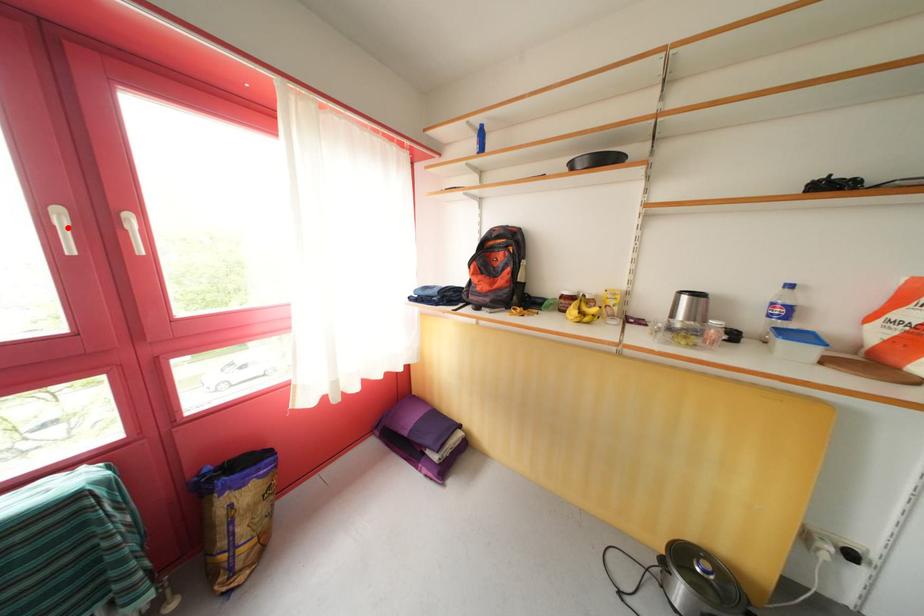
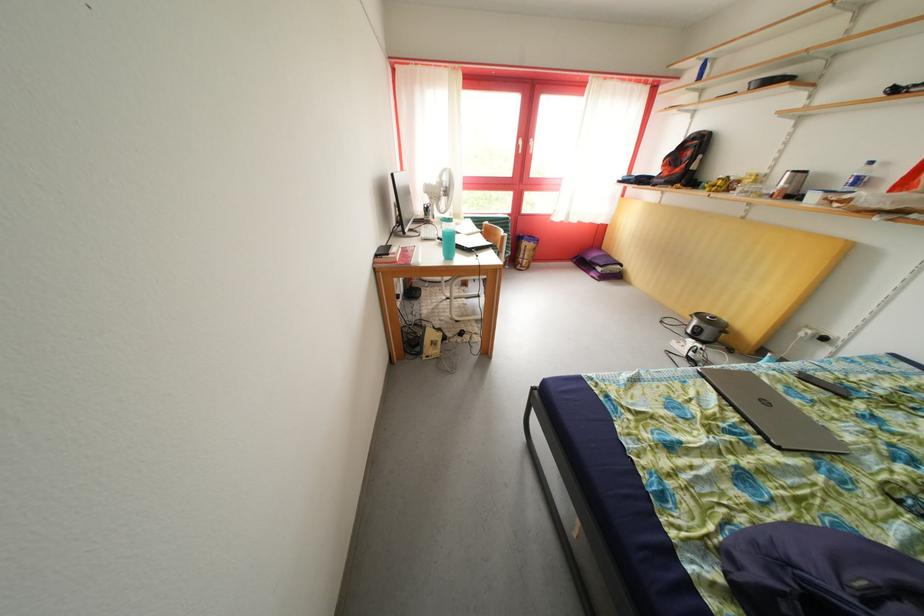
Where in the second image is the point corresponding to the highlighted location from the first image?

(528, 148)